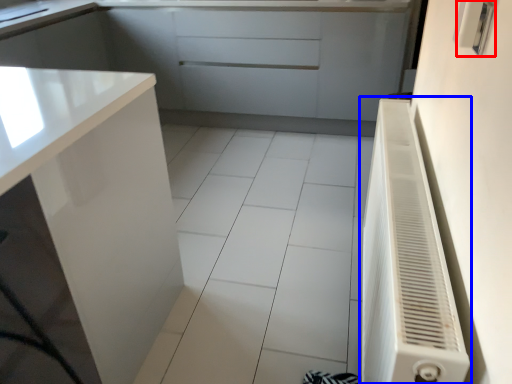
Question: Which point is closer to the camera, electric outlet (highlighted by a red box) or air conditioner (highlighted by a blue box)?

Choices:
 (A) electric outlet
 (B) air conditioner

Answer: (B)